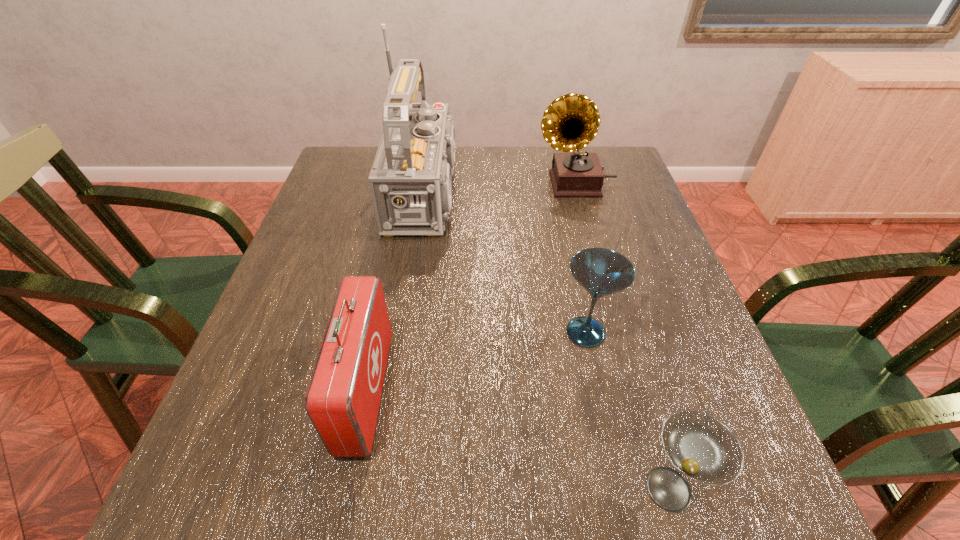
I want to click on free spot located 0.270m on the left of the farther martini, so click(420, 332).

Identify the location of vacant position located 0.290m on the left of the nearer martini. This screenshot has height=540, width=960. (442, 489).

This screenshot has height=540, width=960. In order to click on radio receiver located at the far edge in this screenshot , I will do `click(410, 181)`.

Find the location of a particular element. This screenshot has width=960, height=540. phonograph record that is at the far edge is located at coordinates (570, 122).

The height and width of the screenshot is (540, 960). Find the location of `object that is at the near edge`. object that is at the near edge is located at coordinates (704, 449).

Where is `phonograph record located at the right edge`? This screenshot has width=960, height=540. phonograph record located at the right edge is located at coordinates (570, 122).

Identify the location of martini that is at the right edge. (704, 449).

The width and height of the screenshot is (960, 540). Find the location of `object present at the far right corner`. object present at the far right corner is located at coordinates (570, 122).

The height and width of the screenshot is (540, 960). Find the location of `object positioned at the near right corner`. object positioned at the near right corner is located at coordinates (704, 449).

In the image, there is a desktop. Identify the location of vacant space at the far edge. (514, 150).